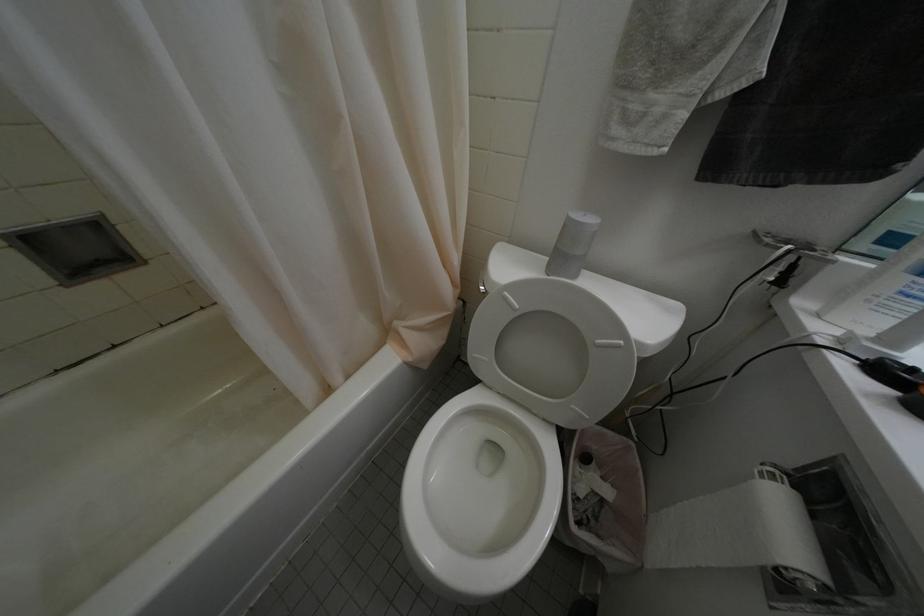
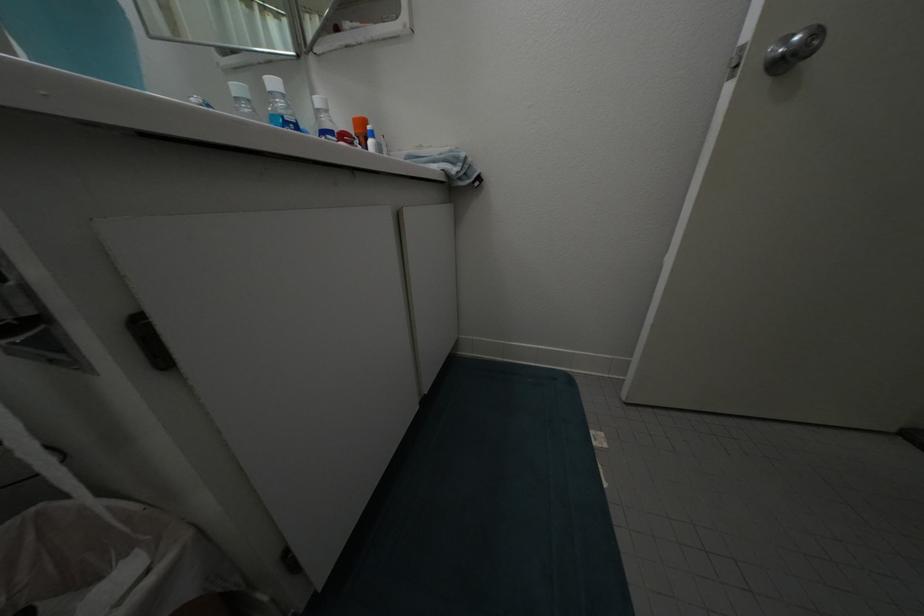
How did the camera likely rotate?

The camera rotated toward right-down.